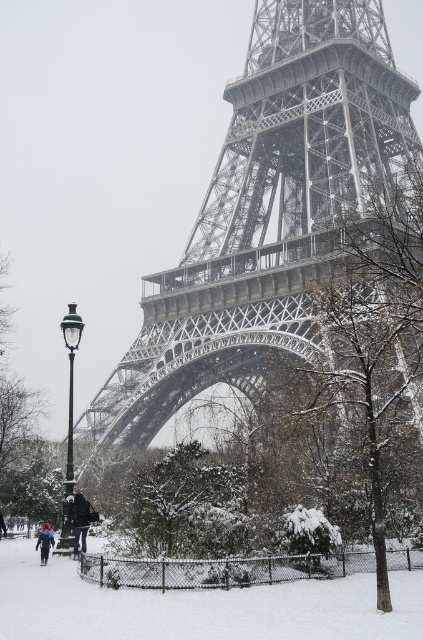
You are standing next to the black matte jacket at lower left and want to take a photo of the metallic gray eiffel tower at center. If your camera has a maximum zoom range of 10 meters, will you be able to capture the entire eiffel tower in the photo without moving closer?

The distance between the metallic gray eiffel tower at center and the black matte jacket at lower left is 36.42 meters. Since your camera can only zoom up to 10 meters, you won cannot capture the entire eiffel tower without moving closer.

You are standing in the snowy park near the Eiffel Tower. You want to take a photo of the metallic gray eiffel tower at center. If your camera can focus on objects up to 100 meters away, will you be able to capture a clear photo of the tower?

The metallic gray eiffel tower at center is 70.88 meters away from the camera. Since the camera can focus up to 100 meters, you can capture a clear photo of the tower as the distance is within the camera range.